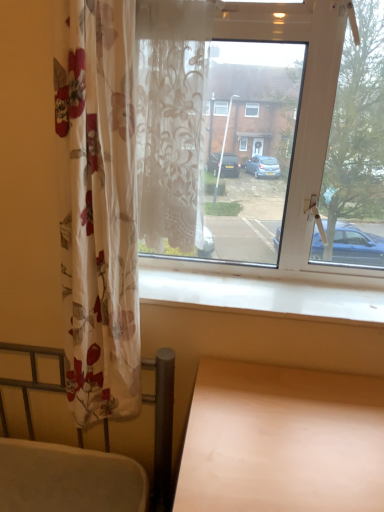
Question: Can you confirm if transparent glass window at center is shorter than light wood table at lower right?

Choices:
 (A) yes
 (B) no

Answer: (B)

Question: Is transparent glass window at center facing away from light wood table at lower right?

Choices:
 (A) yes
 (B) no

Answer: (B)

Question: From a real-world perspective, is transparent glass window at center positioned over light wood table at lower right based on gravity?

Choices:
 (A) yes
 (B) no

Answer: (A)

Question: From the image's perspective, is transparent glass window at center on top of light wood table at lower right?

Choices:
 (A) yes
 (B) no

Answer: (A)

Question: From a real-world perspective, is transparent glass window at center beneath light wood table at lower right?

Choices:
 (A) no
 (B) yes

Answer: (A)

Question: Considering the positions of light wood table at lower right and translucent floral curtain at center in the image, is light wood table at lower right bigger or smaller than translucent floral curtain at center?

Choices:
 (A) small
 (B) big

Answer: (B)

Question: From the image's perspective, is light wood table at lower right located above or below translucent floral curtain at center?

Choices:
 (A) below
 (B) above

Answer: (A)

Question: From a real-world perspective, is light wood table at lower right above or below translucent floral curtain at center?

Choices:
 (A) above
 (B) below

Answer: (B)

Question: In terms of height, does light wood table at lower right look taller or shorter compared to translucent floral curtain at center?

Choices:
 (A) short
 (B) tall

Answer: (A)

Question: Choose the correct answer: Is translucent floral curtain at center inside transparent glass window at center or outside it?

Choices:
 (A) outside
 (B) inside

Answer: (A)

Question: From the image's perspective, is translucent floral curtain at center located above or below transparent glass window at center?

Choices:
 (A) below
 (B) above

Answer: (B)

Question: Is translucent floral curtain at center taller or shorter than transparent glass window at center?

Choices:
 (A) tall
 (B) short

Answer: (B)

Question: In the image, is translucent floral curtain at center on the left side or the right side of transparent glass window at center?

Choices:
 (A) left
 (B) right

Answer: (A)

Question: Do you think transparent glass window at center is within white smooth window sill at lower center, or outside of it?

Choices:
 (A) inside
 (B) outside

Answer: (B)

Question: In the image, is transparent glass window at center on the left side or the right side of white smooth window sill at lower center?

Choices:
 (A) left
 (B) right

Answer: (B)